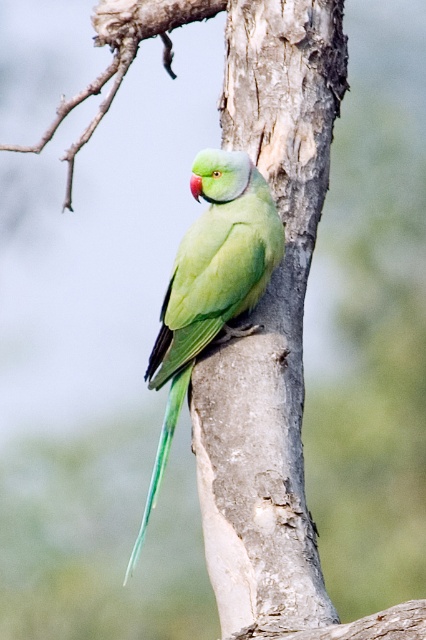
Can you confirm if green matte parrot at center is bigger than smooth bark tree branch at upper center?

No.

Measure the distance between point (238, 204) and camera.

The distance of point (238, 204) from camera is 9.13 feet.

What are the coordinates of `green matte parrot at center` in the screenshot? It's located at (210, 284).

Is smooth bark tree trunk at center taller than green matte parrot at center?

Yes.

Between smooth bark tree trunk at center and green matte parrot at center, which one appears on the left side from the viewer's perspective?

green matte parrot at center is more to the left.

Identify the location of smooth bark tree trunk at center. This screenshot has width=426, height=640. (268, 324).

At what (x,y) coordinates should I click in order to perform the action: click on smooth bark tree trunk at center. Please return your answer as a coordinate pair (x, y). Looking at the image, I should click on (268, 324).

Does smooth bark tree trunk at center have a lesser height compared to smooth bark tree branch at upper center?

No.

What do you see at coordinates (268, 324) in the screenshot? This screenshot has width=426, height=640. I see `smooth bark tree trunk at center` at bounding box center [268, 324].

I want to click on smooth bark tree trunk at center, so click(x=268, y=324).